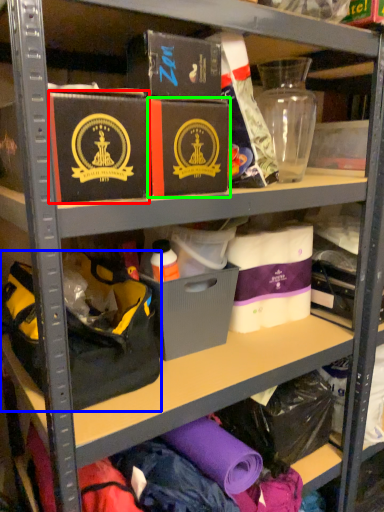
Question: Estimate the real-world distances between objects in this image. Which object is closer to box (highlighted by a red box), handbag (highlighted by a blue box) or box (highlighted by a green box)?

Choices:
 (A) handbag
 (B) box

Answer: (B)